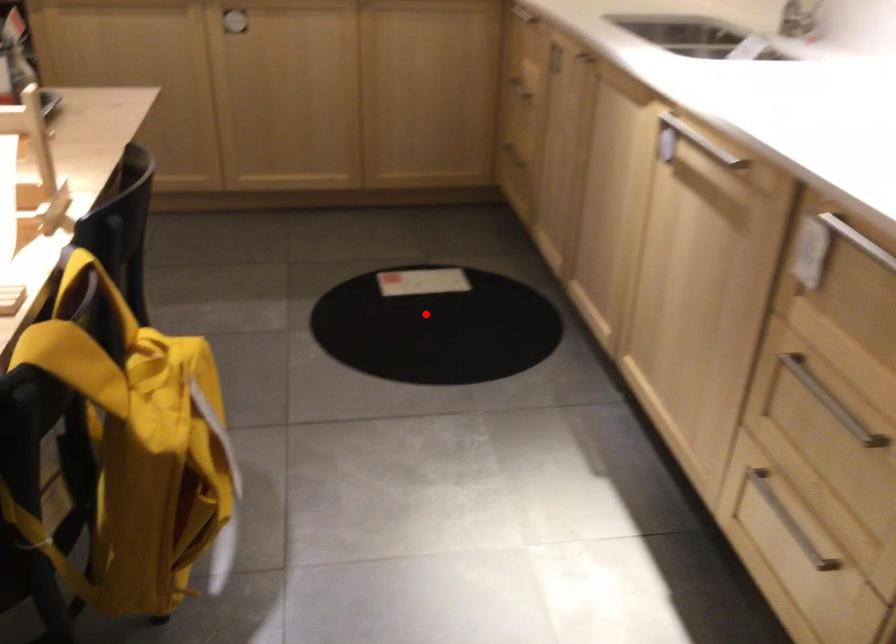
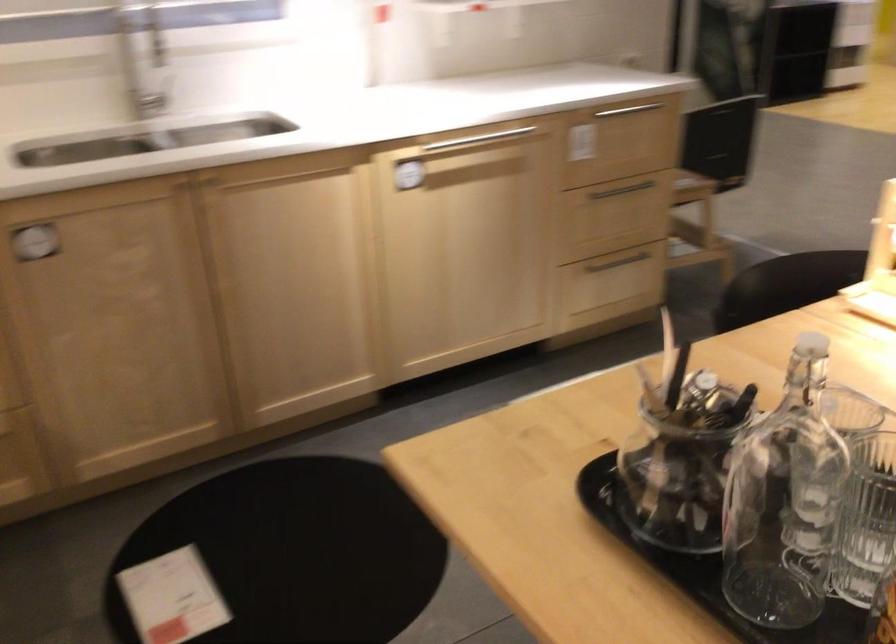
Question: I am providing you with two images of the same scene from different viewpoints. A red point is shown in image1. For the corresponding object point in image2, is it positioned nearer or farther from the camera?

Choices:
 (A) Nearer
 (B) Farther

Answer: (A)